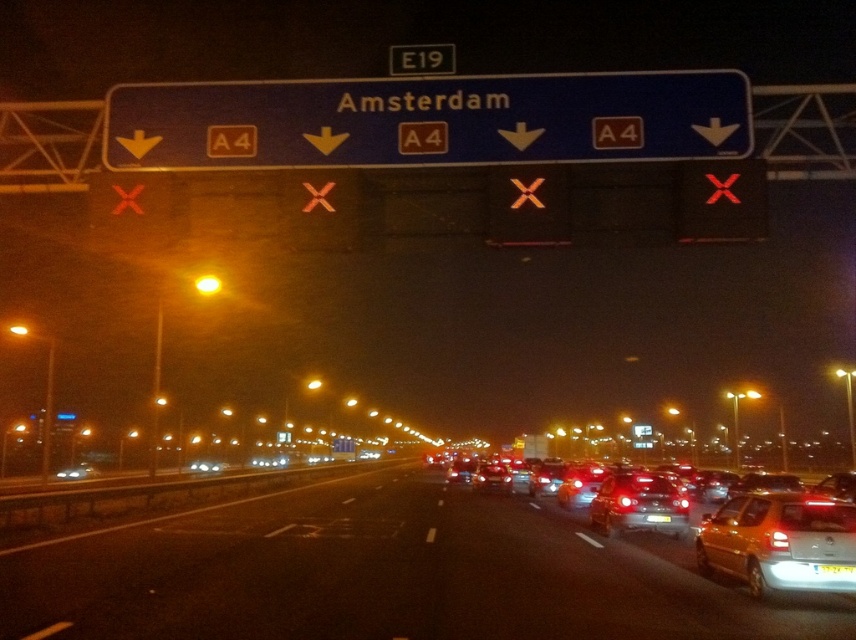
Question: Among these points, which one is nearest to the camera?

Choices:
 (A) (602, 499)
 (B) (663, 545)
 (C) (658, 515)
 (D) (837, 570)

Answer: (D)

Question: Which point is closer to the camera taking this photo?

Choices:
 (A) (726, 541)
 (B) (79, 470)
 (C) (694, 544)
 (D) (843, 566)

Answer: (D)

Question: Which is farther from the shiny metallic car at center?

Choices:
 (A) yellow matte car at lower right
 (B) yellow plastic license plate at center

Answer: (A)

Question: Does blue plastic sign at upper center have a larger size compared to yellow matte car at lower right?

Choices:
 (A) no
 (B) yes

Answer: (A)

Question: Does blue plastic sign at upper center have a smaller size compared to matte silver car at center?

Choices:
 (A) no
 (B) yes

Answer: (B)

Question: Does black asphalt highway at center have a larger size compared to metallic silver car at center?

Choices:
 (A) no
 (B) yes

Answer: (B)